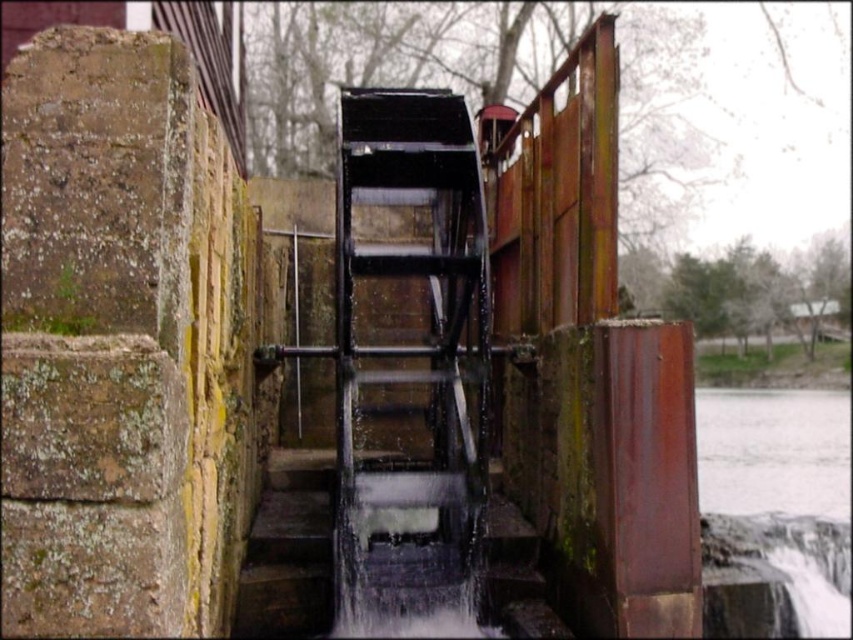
Question: From the image, what is the correct spatial relationship of white frothy water at lower right in relation to rusty metal stairs at center?

Choices:
 (A) below
 (B) above

Answer: (A)

Question: Is white frothy water at lower right bigger than rusty metal stairs at center?

Choices:
 (A) no
 (B) yes

Answer: (B)

Question: Which of the following is the farthest from the observer?

Choices:
 (A) white frothy water at lower right
 (B) rusty metal stairs at center

Answer: (B)

Question: Among these points, which one is nearest to the camera?

Choices:
 (A) (698, 424)
 (B) (279, 612)

Answer: (B)

Question: Can you confirm if white frothy water at lower right is positioned to the right of rusty metal stairs at center?

Choices:
 (A) no
 (B) yes

Answer: (B)